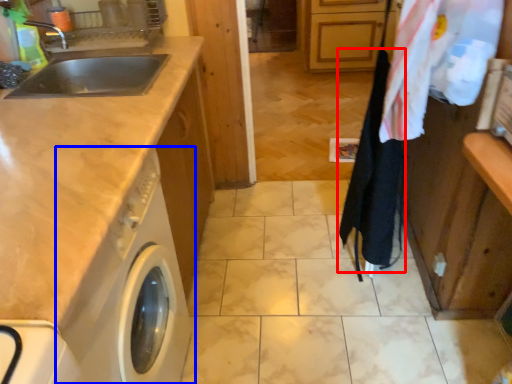
Question: Among these objects, which one is nearest to the camera, clothesline (highlighted by a red box) or washing machine (highlighted by a blue box)?

Choices:
 (A) clothesline
 (B) washing machine

Answer: (B)